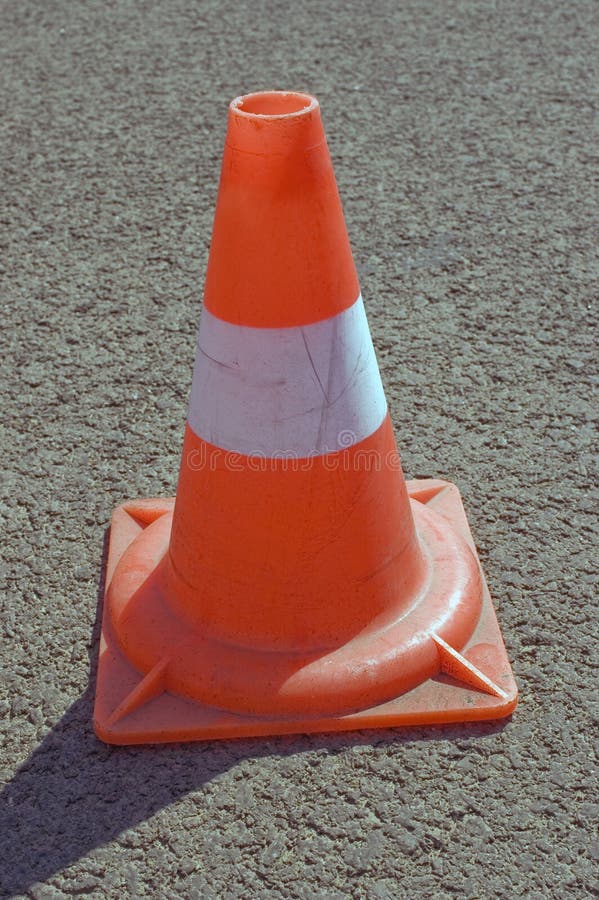
Where is `corner`? Image resolution: width=599 pixels, height=900 pixels. corner is located at coordinates (447, 479), (497, 706), (92, 743), (121, 519).